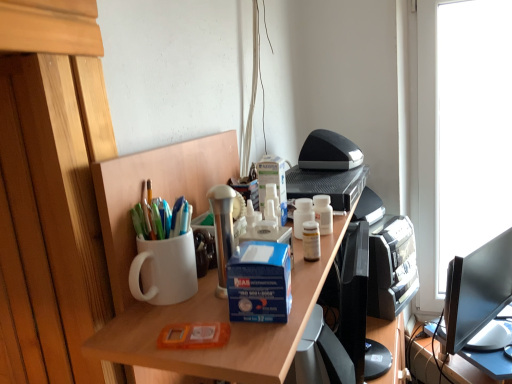
Question: Is orange plastic case at center, which is the 2th stationery from top to bottom, to the right of white matte desk at center from the viewer's perspective?

Choices:
 (A) yes
 (B) no

Answer: (B)

Question: Considering the relative sizes of orange plastic case at center, positioned as the second stationery in back-to-front order, and white matte desk at center in the image provided, is orange plastic case at center, positioned as the second stationery in back-to-front order, smaller than white matte desk at center?

Choices:
 (A) no
 (B) yes

Answer: (B)

Question: From a real-world perspective, is orange plastic case at center, which is counted as the 1th stationery, starting from the front, physically above white matte desk at center?

Choices:
 (A) no
 (B) yes

Answer: (B)

Question: Can you confirm if orange plastic case at center, positioned as the 1th stationery in left-to-right order, is positioned to the left of white matte desk at center?

Choices:
 (A) no
 (B) yes

Answer: (B)

Question: Is orange plastic case at center, which is the 2th stationery from top to bottom, positioned before white matte desk at center?

Choices:
 (A) no
 (B) yes

Answer: (A)

Question: Looking at their shapes, would you say blue cardboard box at center is wider or thinner than white matte desk at center?

Choices:
 (A) wide
 (B) thin

Answer: (B)

Question: From a real-world perspective, is blue cardboard box at center positioned above or below white matte desk at center?

Choices:
 (A) below
 (B) above

Answer: (B)

Question: Would you say blue cardboard box at center is inside or outside white matte desk at center?

Choices:
 (A) inside
 (B) outside

Answer: (B)

Question: Looking at the image, does blue cardboard box at center seem bigger or smaller compared to white matte desk at center?

Choices:
 (A) small
 (B) big

Answer: (A)

Question: From their relative heights in the image, would you say white matte desk at center is taller or shorter than blue cardboard box at center?

Choices:
 (A) short
 (B) tall

Answer: (B)

Question: From the image's perspective, is white matte desk at center above or below blue cardboard box at center?

Choices:
 (A) above
 (B) below

Answer: (B)

Question: Is white matte desk at center bigger or smaller than blue cardboard box at center?

Choices:
 (A) small
 (B) big

Answer: (B)

Question: From a real-world perspective, is white matte desk at center physically located above or below blue cardboard box at center?

Choices:
 (A) below
 (B) above

Answer: (A)

Question: Choose the correct answer: Is orange plastic case at center, which is the 2th stationery from top to bottom, inside white matte desk at center or outside it?

Choices:
 (A) outside
 (B) inside

Answer: (A)

Question: Considering the positions of orange plastic case at center, positioned as the second stationery in back-to-front order, and white matte desk at center in the image, is orange plastic case at center, positioned as the second stationery in back-to-front order, bigger or smaller than white matte desk at center?

Choices:
 (A) big
 (B) small

Answer: (B)